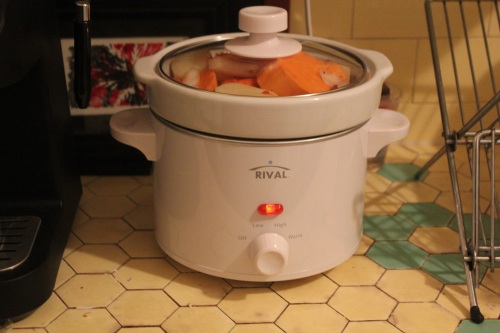
At what (x,y) coordinates should I click in order to perform the action: click on floor. Please return your answer as a coordinate pair (x, y). The height and width of the screenshot is (333, 500). Looking at the image, I should click on (296, 301).